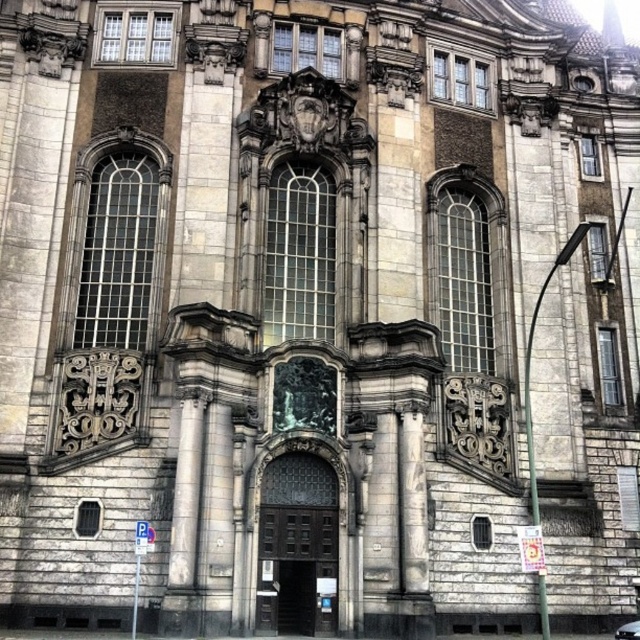
Is white marble column at center smaller than metallic silver car at center?

Yes.

Is white marble column at center bigger than metallic silver car at center?

No, white marble column at center is not bigger than metallic silver car at center.

Who is more distant from viewer, (406, 442) or (627, 637)?

Positioned behind is point (406, 442).

At what (x,y) coordinates should I click in order to perform the action: click on white marble column at center. Please return your answer as a coordinate pair (x, y). This screenshot has height=640, width=640. Looking at the image, I should click on (412, 504).